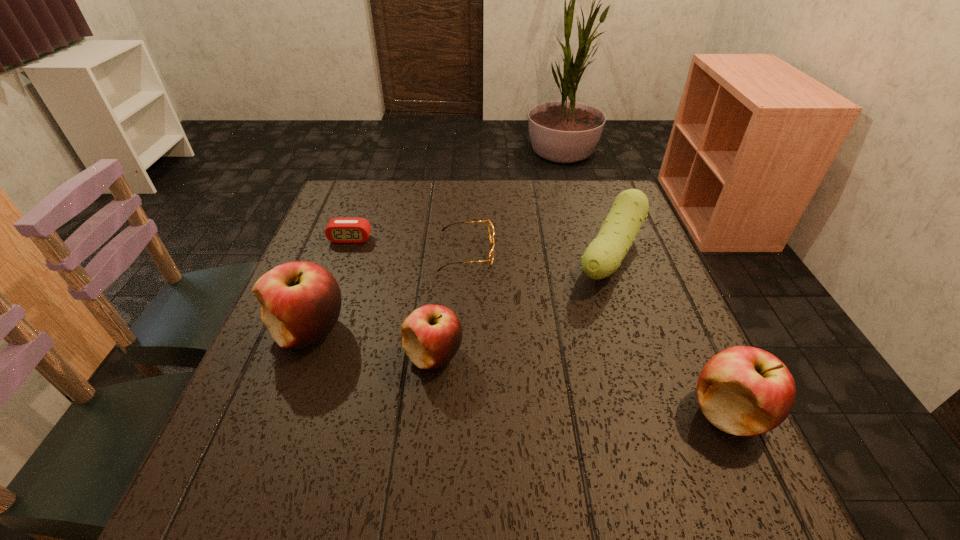
The height and width of the screenshot is (540, 960). I want to click on vacant space that's between the shortest apple and the cucumber, so click(x=522, y=306).

Find the location of a particular element. Image resolution: width=960 pixels, height=540 pixels. empty space between the cucumber and the alarm clock is located at coordinates (480, 247).

Identify the location of free area in between the alarm clock and the cucumber. The image size is (960, 540). (480, 247).

You are a GUI agent. You are given a task and a screenshot of the screen. Output one action in this format:
    pyautogui.click(x=<x>, y=<y>)
    Task: Click on the empty space that is in between the spectacles and the alarm clock
    
    Given the screenshot: What is the action you would take?
    pyautogui.click(x=409, y=245)

Locate an element on the screen. This screenshot has height=540, width=960. free space between the second apple from right to left and the cucumber is located at coordinates (522, 306).

Identify the location of unoccupied position between the shortest apple and the fifth shortest object. (581, 384).

Find the location of `blank region between the alarm clock and the fifth shortest object`. blank region between the alarm clock and the fifth shortest object is located at coordinates (540, 326).

This screenshot has width=960, height=540. What are the coordinates of `object that is the fifth closest to the alarm clock` in the screenshot? It's located at (744, 391).

Find the location of `object identified as the second closest to the second apple from right to left`. object identified as the second closest to the second apple from right to left is located at coordinates (490, 226).

Where is `apple object that ranks as the second closest to the spectacles`? The image size is (960, 540). apple object that ranks as the second closest to the spectacles is located at coordinates (300, 301).